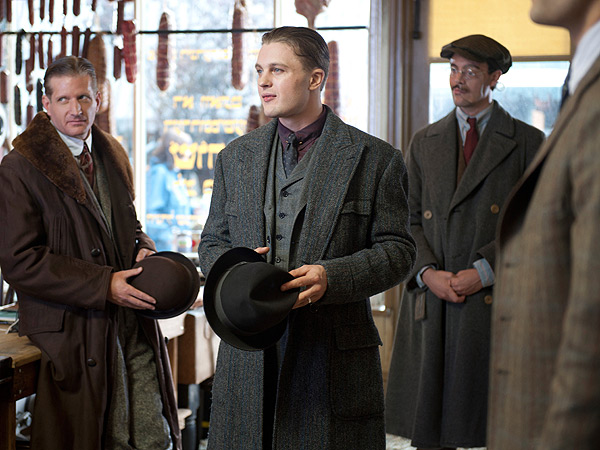
I want to click on coat, so click(x=336, y=393).